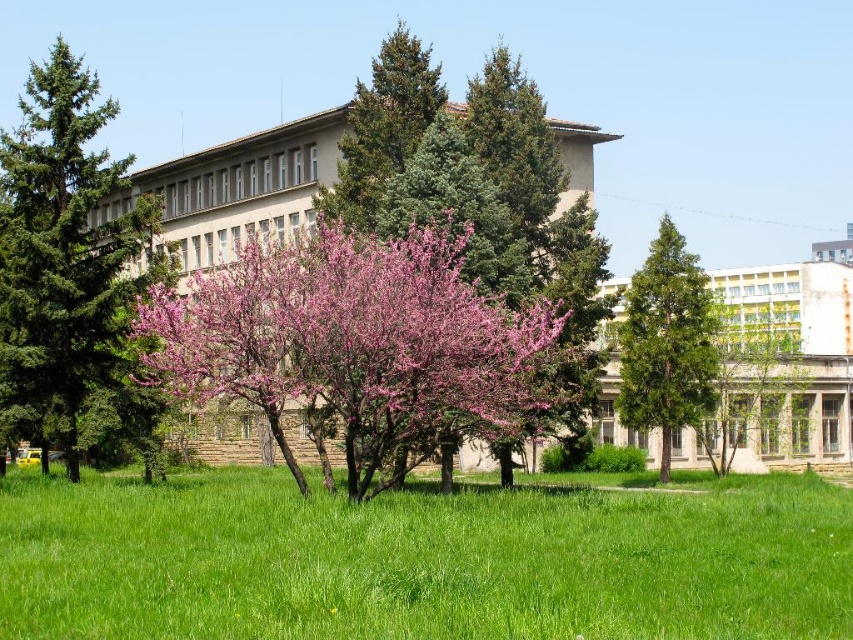
You are standing at the center of the grassy area in front of the building. You want to walk to the green textured tree at left. Which direction should you face to walk straight towards it?

You should face the left direction to walk straight towards the green textured tree at left since it is located at point (68, 268), which is to the left of your current position at the center of the grassy area.

In the scene shown: You are a landscape architect designing a garden path that needs to pass between the pink bloom at center and the green textured tree at upper center. Given that the path must be at least 2 meters wide to accommodate visitors, can you confirm if the space between them allows for this width?

The pink bloom at center has a larger width than the green textured tree at upper center, but the description does not provide specific measurements for the distance between them. Therefore, it is unclear if the space between them is at least 2 meters wide. Additional information about their separation is needed to determine feasibility.

You are standing at the point closest to the viewer in the image. Which point, point [405,416] or point [93,90], is closer to you?

Point [405,416] is in front of point [93,90], so it is closer to you.